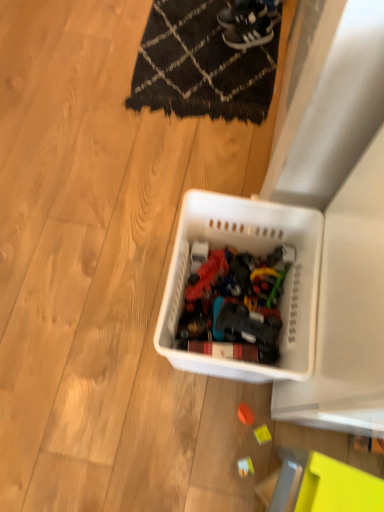
Image resolution: width=384 pixels, height=512 pixels. I want to click on vacant area that is situated to the right of white plastic toy at lower center, which ranks as the 1th toy in bottom-to-top order, so [x=294, y=443].